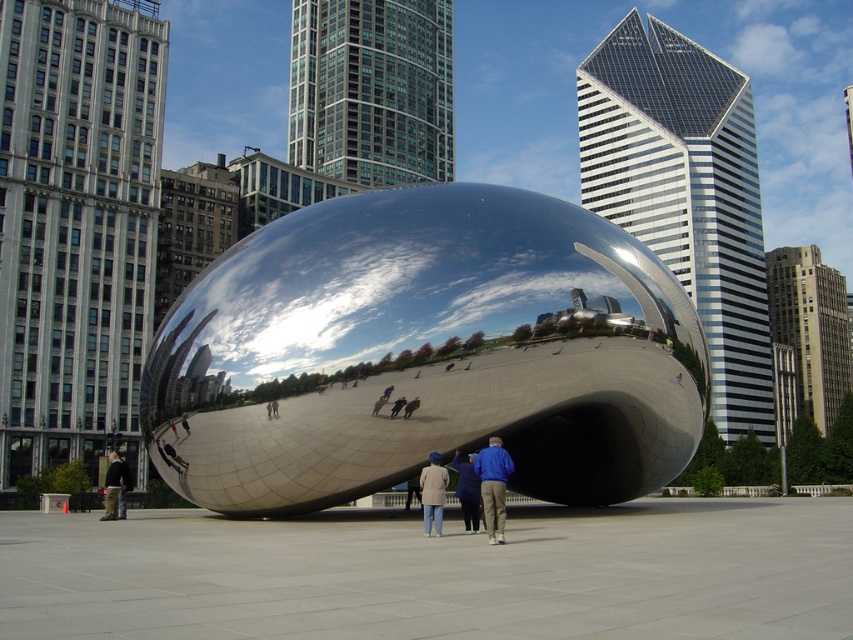
Question: Does beige wool coat at center appear under blue denim jeans at center?

Choices:
 (A) no
 (B) yes

Answer: (A)

Question: Which object appears farthest from the camera in this image?

Choices:
 (A) beige wool coat at center
 (B) blue denim jacket at center

Answer: (A)

Question: Does beige wool coat at center appear on the right side of dark gray jacket at lower left?

Choices:
 (A) no
 (B) yes

Answer: (B)

Question: Is beige wool coat at center smaller than dark gray jacket at lower left?

Choices:
 (A) yes
 (B) no

Answer: (A)

Question: Which of the following is the closest to the observer?

Choices:
 (A) (485, 515)
 (B) (486, 458)
 (C) (428, 468)

Answer: (A)

Question: Estimate the real-world distances between objects in this image. Which object is farther from the beige wool coat at center?

Choices:
 (A) dark gray jacket at lower left
 (B) blue denim jacket at center
 (C) blue denim jeans at center

Answer: (A)